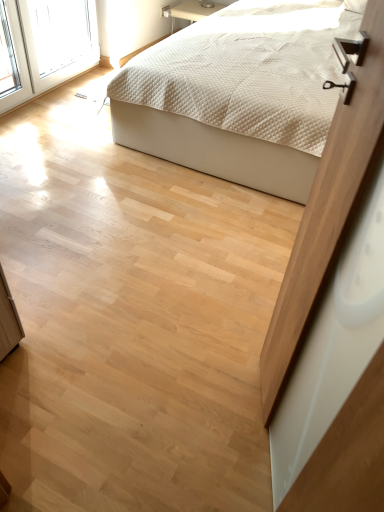
This screenshot has width=384, height=512. What are the coordinates of `vacant space to the left of matte wood screen door at upper right` in the screenshot? It's located at (174, 422).